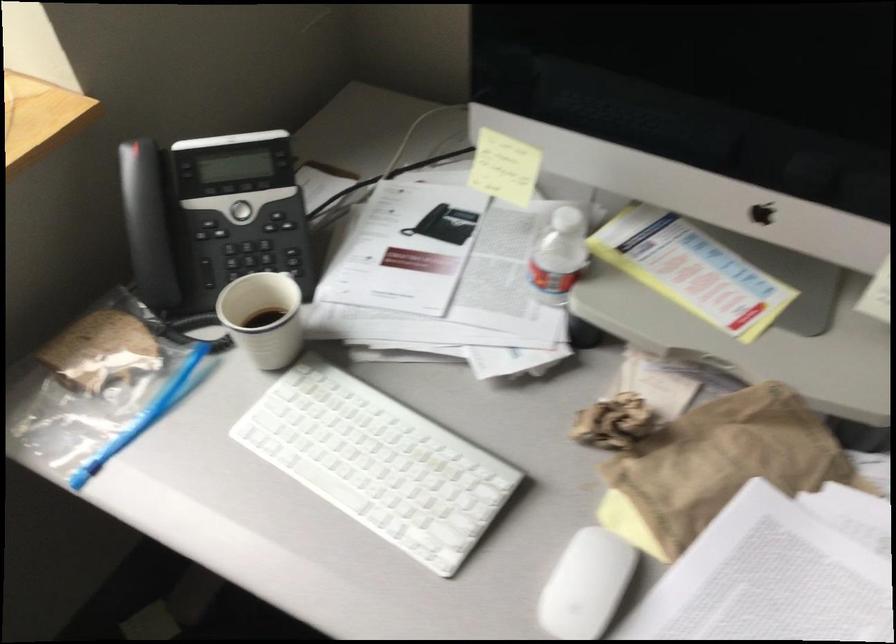
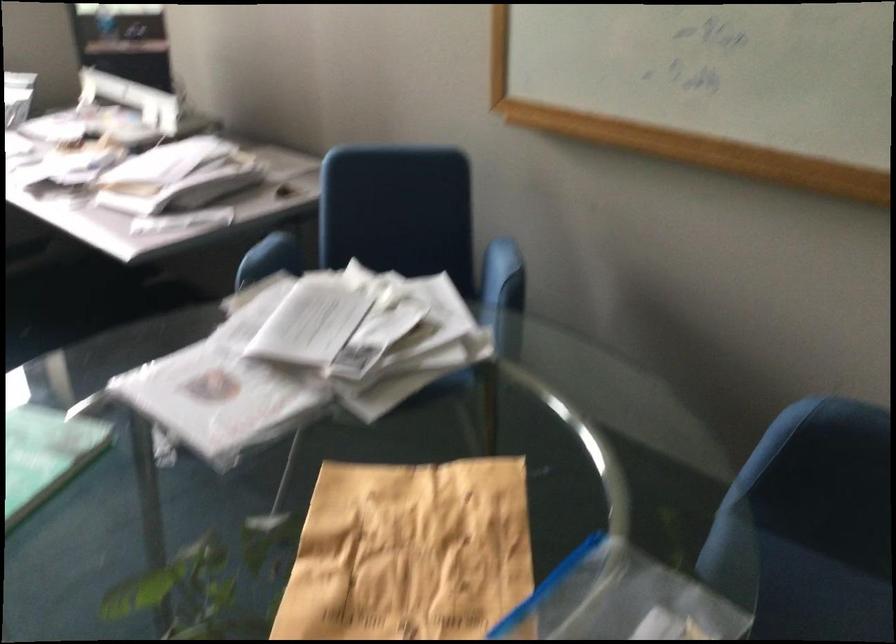
In a continuous first-person perspective shot, in which direction is the camera moving?

The cameraman moved toward right, backward.